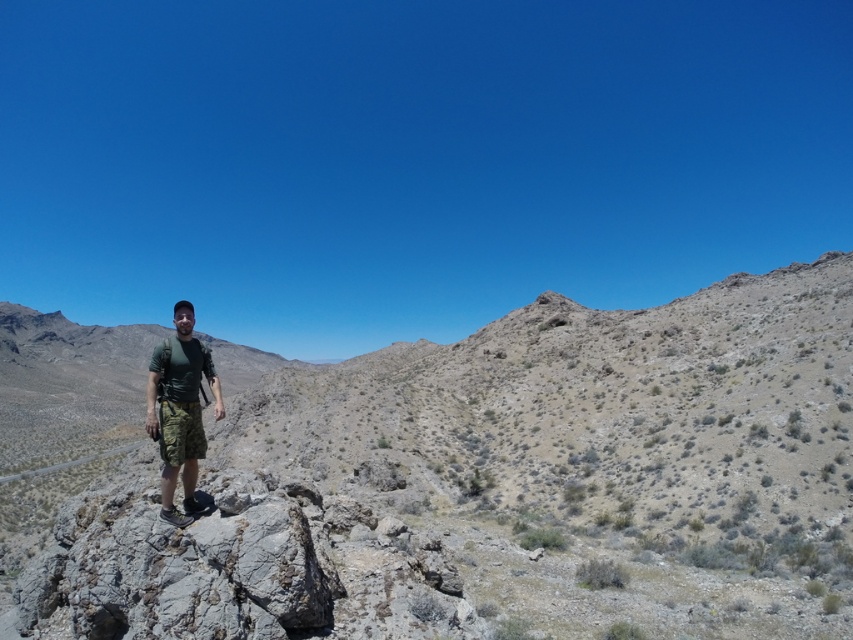
Question: Where is gray rocky mountain at center located in relation to green camouflage shorts at center in the image?

Choices:
 (A) right
 (B) left

Answer: (B)

Question: Does gray rocky mountain at center come in front of green camouflage shorts at center?

Choices:
 (A) yes
 (B) no

Answer: (A)

Question: Considering the relative positions of gray rocky mountain at center and green camouflage shorts at center in the image provided, where is gray rocky mountain at center located with respect to green camouflage shorts at center?

Choices:
 (A) right
 (B) left

Answer: (B)